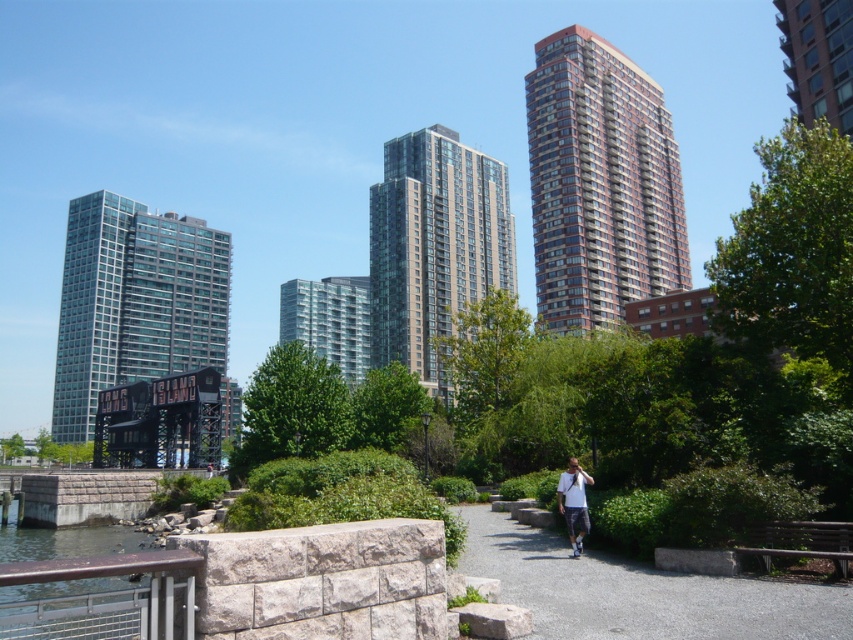
Question: Does reddish-brown glassy building at center-right come behind white cotton shirt at center?

Choices:
 (A) yes
 (B) no

Answer: (A)

Question: Which of the following is the closest to the observer?

Choices:
 (A) glassy teal skyscraper at left
 (B) red brick building at upper right
 (C) glassy steel building at center

Answer: (B)

Question: Among these objects, which one is nearest to the camera?

Choices:
 (A) clear glass building at center
 (B) glassy steel building at center

Answer: (B)

Question: Where is gray gravel path at center located in relation to red brick building at upper right in the image?

Choices:
 (A) above
 (B) below

Answer: (B)

Question: Is the position of reddish-brown glassy building at center-right more distant than that of clear glass building at center?

Choices:
 (A) no
 (B) yes

Answer: (A)

Question: Which object is closer to the camera taking this photo?

Choices:
 (A) clear glass building at center
 (B) reddish-brown glassy building at center-right
 (C) white cotton shirt at center
 (D) red brick building at upper right

Answer: (C)